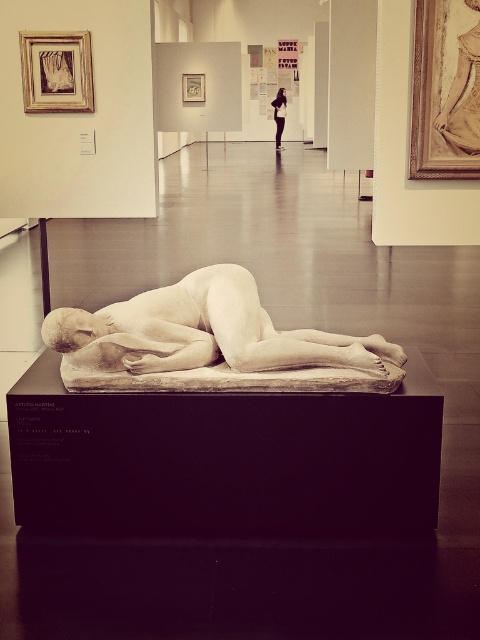
Question: Can you confirm if white marble sculpture at center is positioned above black leather jacket at upper center?

Choices:
 (A) yes
 (B) no

Answer: (B)

Question: Which point is farther from the camera taking this photo?

Choices:
 (A) (284, 120)
 (B) (196, 353)

Answer: (A)

Question: Which object is closer to the camera taking this photo?

Choices:
 (A) black leather jacket at upper center
 (B) white marble sculpture at center

Answer: (B)

Question: Does white marble sculpture at center appear on the right side of black leather jacket at upper center?

Choices:
 (A) no
 (B) yes

Answer: (A)

Question: Can you confirm if white marble sculpture at center is thinner than black leather jacket at upper center?

Choices:
 (A) no
 (B) yes

Answer: (A)

Question: Among these objects, which one is nearest to the camera?

Choices:
 (A) white marble sculpture at center
 (B) black leather jacket at upper center

Answer: (A)